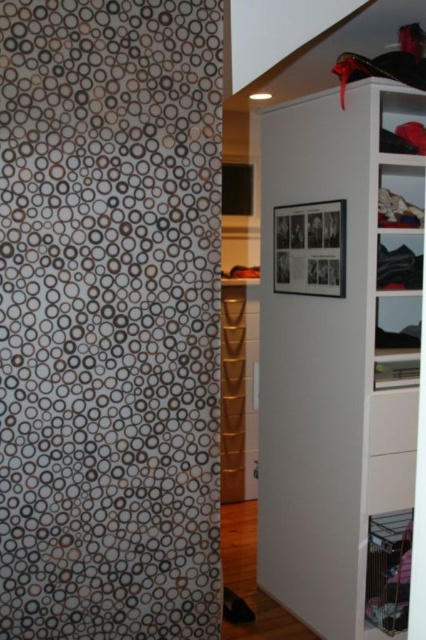
Does white matte shower curtain at left appear over white matte cabinet at upper right?

Yes, white matte shower curtain at left is above white matte cabinet at upper right.

Who is more distant from viewer, [101,620] or [276,516]?

The point [276,516] is behind.

Is point (62, 20) farther from viewer compared to point (393, 97)?

No, it is not.

You are a GUI agent. You are given a task and a screenshot of the screen. Output one action in this format:
    pyautogui.click(x=<x>, y=<y>)
    Task: Click on the white matte shower curtain at left
    The width and height of the screenshot is (426, 640).
    Given the screenshot: What is the action you would take?
    pyautogui.click(x=109, y=317)